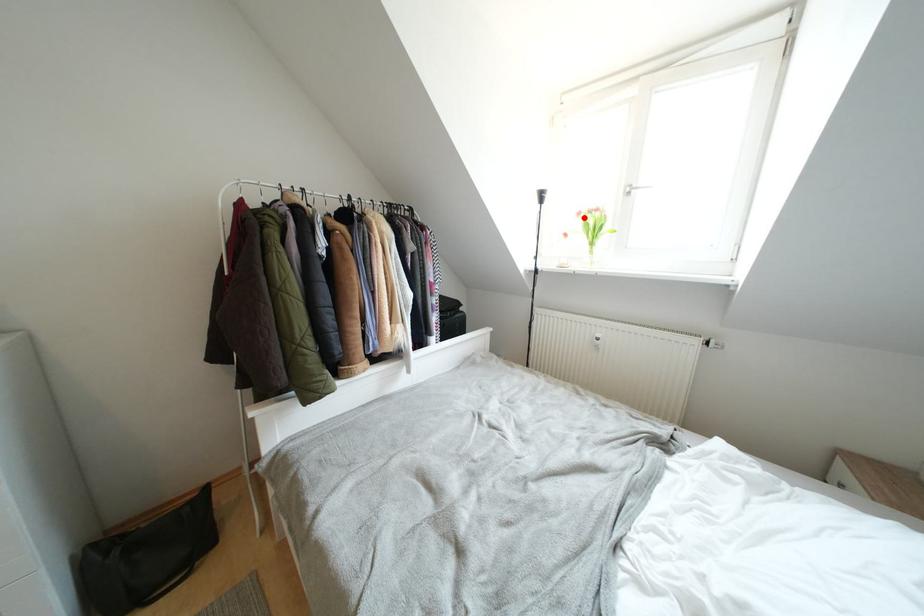
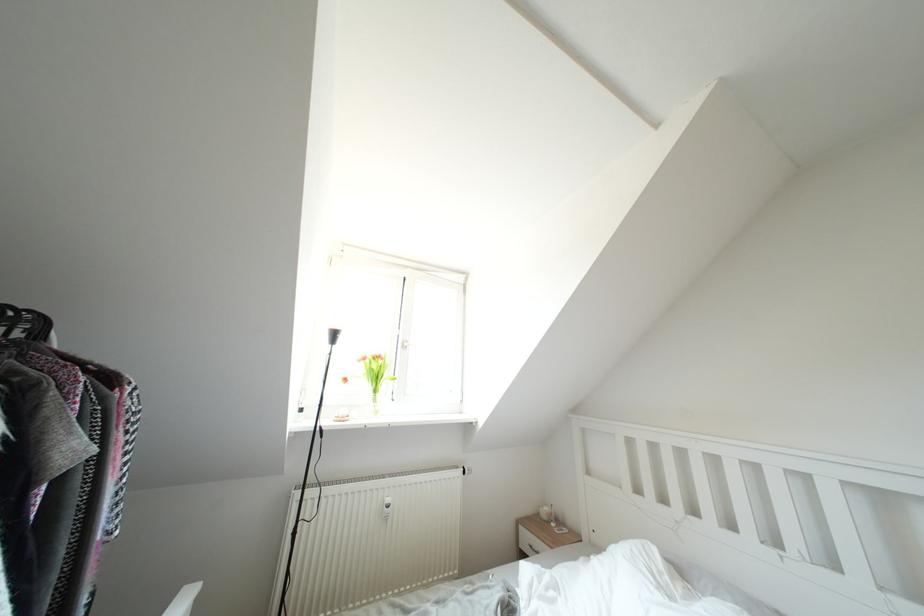
Question: I am providing you with two images of the same scene from different viewpoints. Given a red point in image1, look at the same physical point in image2. Is it:

Choices:
 (A) Closer to the viewpoint
 (B) Farther from the viewpoint

Answer: (B)